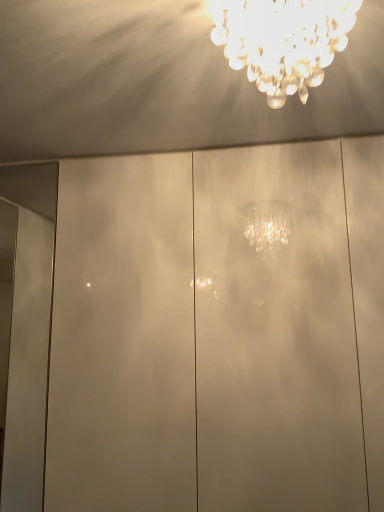
Question: Is white glossy door at left in front of clear crystal chandelier at upper center?

Choices:
 (A) no
 (B) yes

Answer: (A)

Question: Is white glossy door at left turned away from clear crystal chandelier at upper center?

Choices:
 (A) yes
 (B) no

Answer: (B)

Question: Does white glossy door at left come behind clear crystal chandelier at upper center?

Choices:
 (A) yes
 (B) no

Answer: (A)

Question: Could you tell me if white glossy door at left is facing clear crystal chandelier at upper center?

Choices:
 (A) no
 (B) yes

Answer: (A)

Question: From the image's perspective, is white glossy door at left under clear crystal chandelier at upper center?

Choices:
 (A) yes
 (B) no

Answer: (A)

Question: From the image's perspective, does white glossy door at left appear higher than clear crystal chandelier at upper center?

Choices:
 (A) yes
 (B) no

Answer: (B)

Question: Considering the relative sizes of glossy white glass door at center and white glossy door at left in the image provided, is glossy white glass door at center bigger than white glossy door at left?

Choices:
 (A) no
 (B) yes

Answer: (B)

Question: Is glossy white glass door at center wider than white glossy door at left?

Choices:
 (A) yes
 (B) no

Answer: (A)

Question: Are glossy white glass door at center and white glossy door at left far apart?

Choices:
 (A) yes
 (B) no

Answer: (B)

Question: Is glossy white glass door at center further to camera compared to white glossy door at left?

Choices:
 (A) no
 (B) yes

Answer: (A)

Question: From the image's perspective, does glossy white glass door at center appear higher than white glossy door at left?

Choices:
 (A) yes
 (B) no

Answer: (B)

Question: Can you confirm if glossy white glass door at center is smaller than white glossy door at left?

Choices:
 (A) yes
 (B) no

Answer: (B)

Question: Is white glossy door at left aimed at glossy white glass door at center?

Choices:
 (A) no
 (B) yes

Answer: (A)